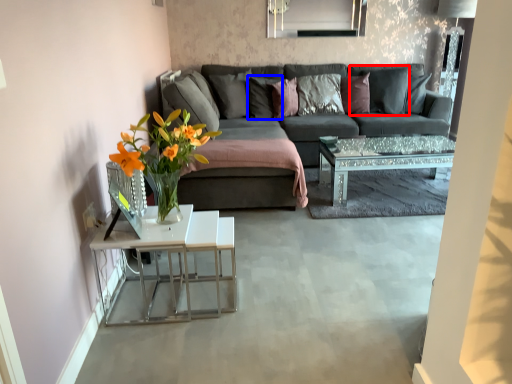
Question: Which object is further to the camera taking this photo, pillow (highlighted by a red box) or pillow (highlighted by a blue box)?

Choices:
 (A) pillow
 (B) pillow

Answer: (B)